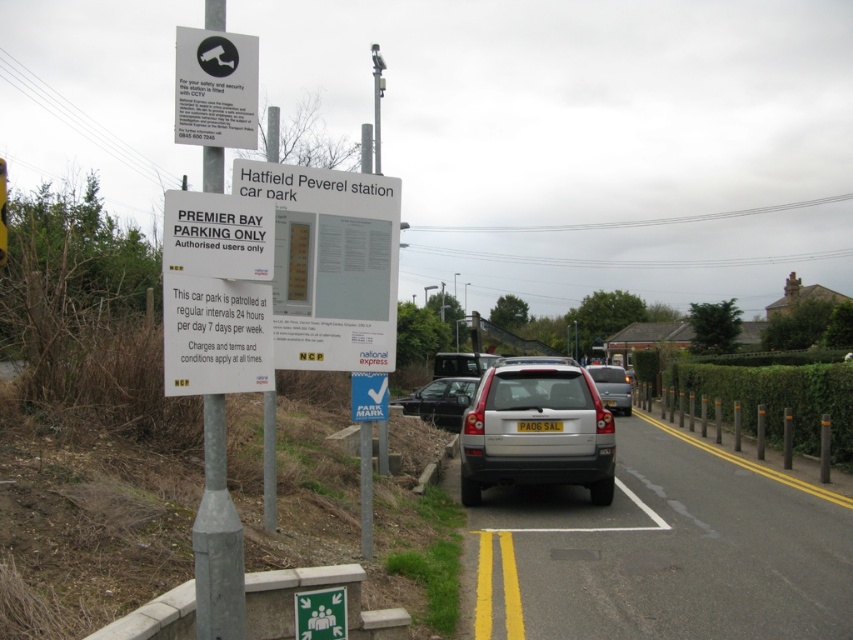
You are standing at the Hatfield Peverel station car park and want to walk from point A to point B. Point A is at coordinate point (469, 396) and point B is at coordinate point (531, 428). Which point will you reach first if you move towards them both?

You will reach point A at coordinate point (469, 396) first because it is closer to you than point B at coordinate point (531, 428).